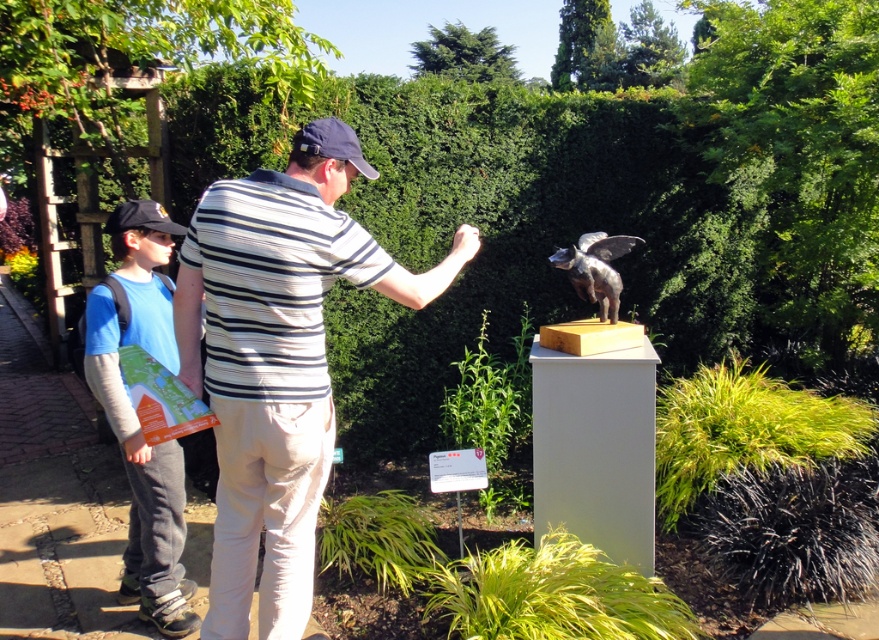
You are a visitor in the garden and want to take a photo of the polished bronze winged animal at center without any obstructions. However, the black fabric baseball cap at left is blocking the view. Can you move the cap to the side to get a clear shot?

Answer: The polished bronze winged animal at center is positioned under the black fabric baseball cap at left, so moving the cap to the side would allow an unobstructed view of the statue.